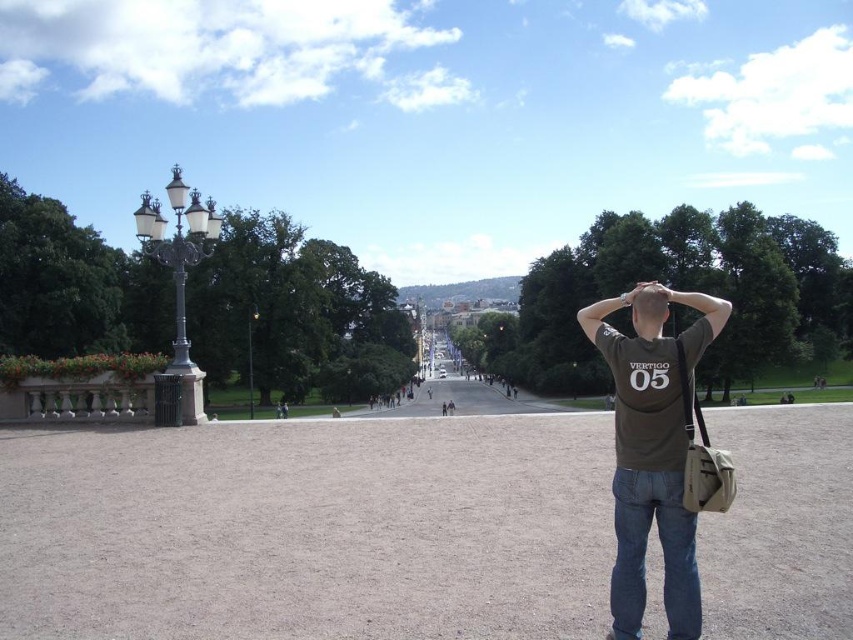
Can you confirm if dark green t-shirt at upper right is smaller than brown hair at upper center?

No.

Who is more distant from viewer, (664,504) or (645,301)?

Point (645,301)

You are a GUI agent. You are given a task and a screenshot of the screen. Output one action in this format:
    pyautogui.click(x=<x>, y=<y>)
    Task: Click on the dark green t-shirt at upper right
    
    Given the screenshot: What is the action you would take?
    pyautogui.click(x=653, y=449)

Can you confirm if polished brass streetlamp at left is positioned below polished brass lamp post at left?

No, polished brass streetlamp at left is not below polished brass lamp post at left.

Measure the distance between polished brass streetlamp at left and polished brass lamp post at left.

27.63 meters

Who is more distant from viewer, (200, 220) or (248, 404)?

Positioned behind is point (248, 404).

What are the coordinates of `polished brass streetlamp at left` in the screenshot? It's located at (178, 250).

Can you confirm if brown hair at upper center is positioned to the right of polished brass lamp post at left?

Yes, brown hair at upper center is to the right of polished brass lamp post at left.

Between point (627, 298) and point (250, 406), which one is positioned in front?

Point (627, 298) is in front.

At what (x,y) coordinates should I click in order to perform the action: click on brown hair at upper center. Please return your answer as a coordinate pair (x, y). The height and width of the screenshot is (640, 853). Looking at the image, I should click on (648, 307).